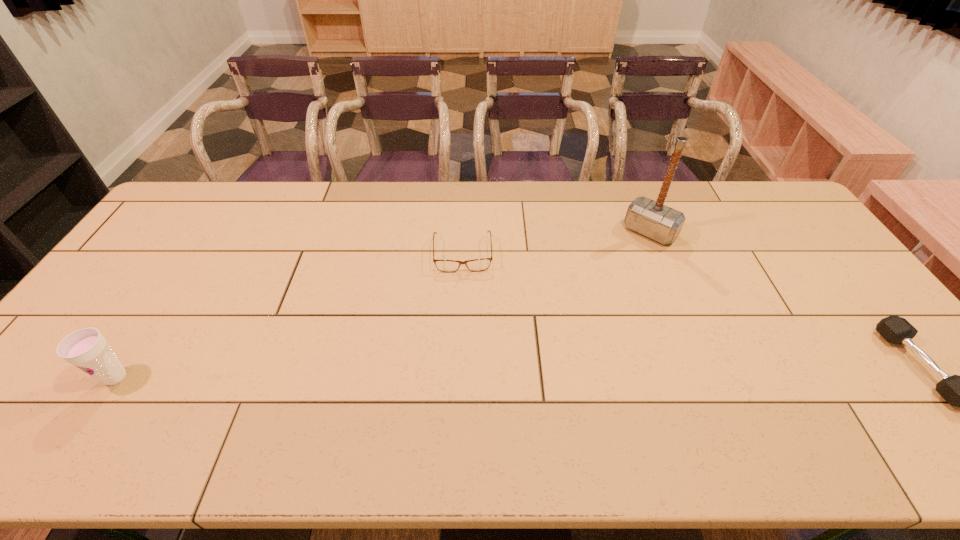
Where is `cup`? This screenshot has height=540, width=960. cup is located at coordinates (87, 349).

This screenshot has height=540, width=960. Find the location of `the second tallest object`. the second tallest object is located at coordinates (87, 349).

Where is `hammer`? The width and height of the screenshot is (960, 540). hammer is located at coordinates (659, 222).

Where is `the tallest object`? the tallest object is located at coordinates (659, 222).

Find the location of a particular element. The height and width of the screenshot is (540, 960). the shortest object is located at coordinates (475, 265).

Locate an element on the screen. The height and width of the screenshot is (540, 960). the third object from right to left is located at coordinates (475, 265).

At what (x,y) coordinates should I click in order to perform the action: click on free location located on the right of the second tallest object. Please return your answer as a coordinate pair (x, y). This screenshot has height=540, width=960. Looking at the image, I should click on (154, 377).

Where is `free space located 0.070m on the striking surface of the tallest object`? This screenshot has width=960, height=540. free space located 0.070m on the striking surface of the tallest object is located at coordinates (628, 255).

Find the location of a particular element. This screenshot has width=960, height=540. free spot located 0.400m on the striking surface of the tallest object is located at coordinates (570, 318).

Image resolution: width=960 pixels, height=540 pixels. I want to click on free location located 0.180m on the striking surface of the tallest object, so click(611, 274).